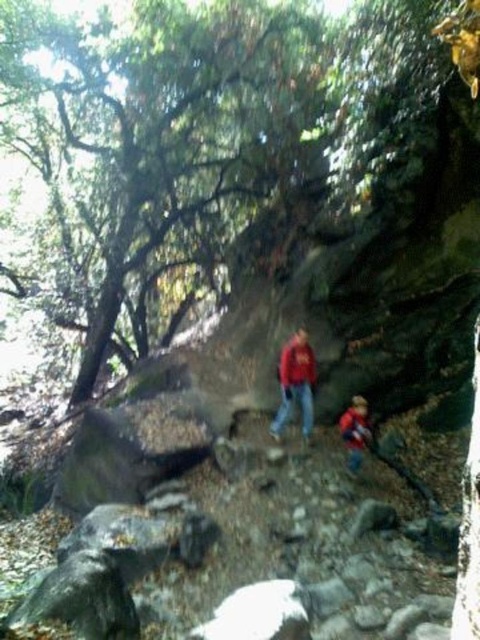
You are hiking and want to take a photo of both the red fabric jacket at lower center and the matte red jacket at center. Which jacket should you focus on first to ensure both are in the frame?

You should focus on the red fabric jacket at lower center first because it is closer to you than the matte red jacket at center, so adjusting the focus to include both would require starting with the closer one.

You are standing at the center of the rocky area and want to locate the green leafy tree at upper left. Which direction should you face to see it?

The green leafy tree at upper left is located at point coordinates of (155, 157). Since you are at the center, facing towards the upper left direction will allow you to see the green leafy tree at upper left.